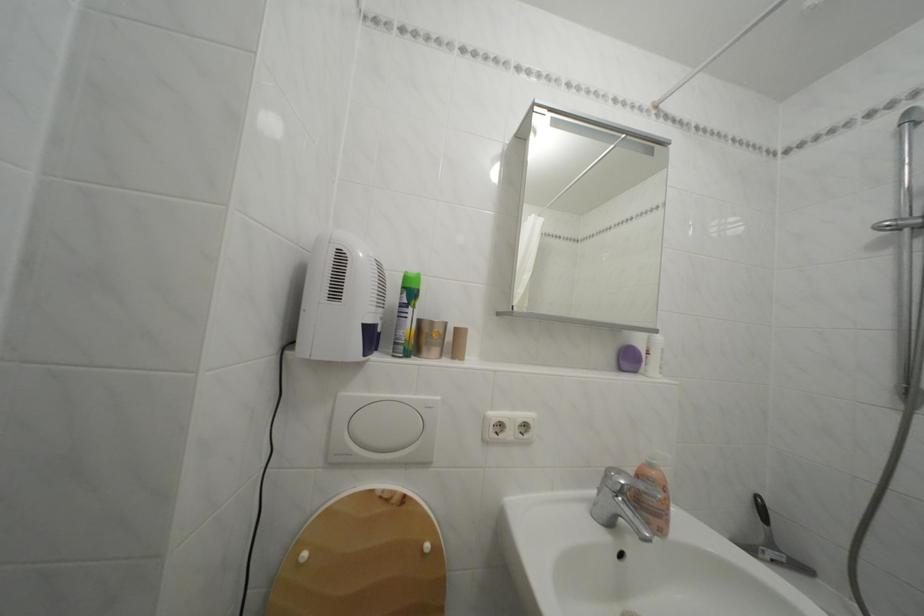
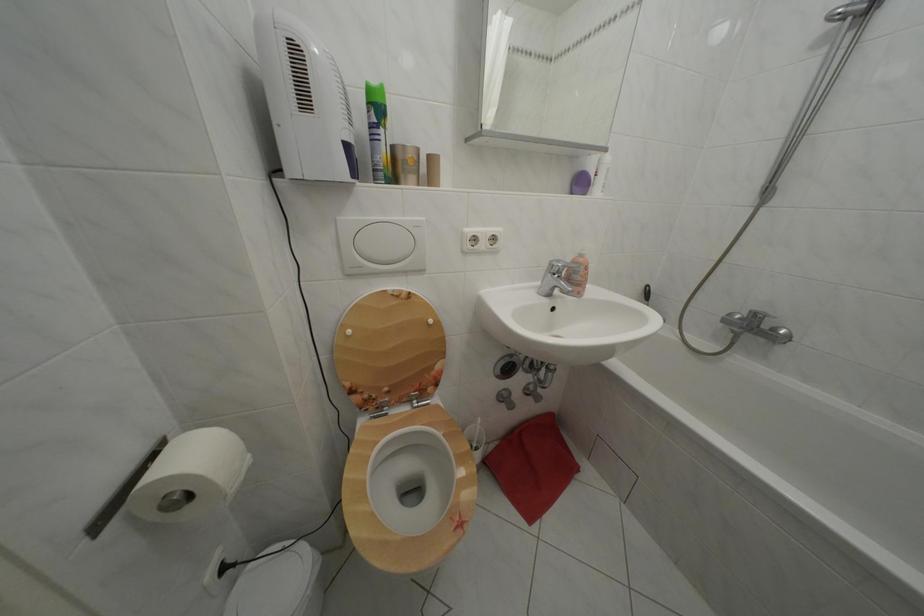
Find the pixel in the second image that matches (627,477) in the first image.

(567, 268)